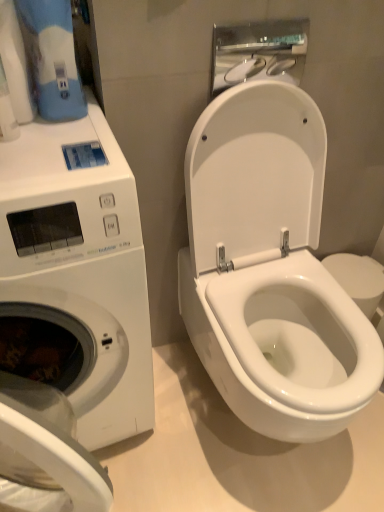
Question: Is white glossy hand dryer at upper center touching white glossy toilet at center?

Choices:
 (A) yes
 (B) no

Answer: (B)

Question: Would you say white glossy hand dryer at upper center is a long distance from white glossy toilet at center?

Choices:
 (A) yes
 (B) no

Answer: (B)

Question: Is white glossy hand dryer at upper center smaller than white glossy toilet at center?

Choices:
 (A) yes
 (B) no

Answer: (A)

Question: Does white glossy hand dryer at upper center come behind white glossy toilet at center?

Choices:
 (A) yes
 (B) no

Answer: (A)

Question: Considering the relative sizes of white glossy hand dryer at upper center and white glossy toilet at center in the image provided, is white glossy hand dryer at upper center thinner than white glossy toilet at center?

Choices:
 (A) yes
 (B) no

Answer: (A)

Question: Is white glossy hand dryer at upper center facing towards white glossy toilet at center?

Choices:
 (A) yes
 (B) no

Answer: (B)

Question: Can you confirm if white glossy toilet at center is positioned to the right of white glossy toilet paper at upper left?

Choices:
 (A) yes
 (B) no

Answer: (A)

Question: Does white glossy toilet at center have a greater height compared to white glossy toilet paper at upper left?

Choices:
 (A) yes
 (B) no

Answer: (A)

Question: Is white glossy toilet at center in front of white glossy toilet paper at upper left?

Choices:
 (A) no
 (B) yes

Answer: (B)

Question: Is white glossy toilet at center positioned far away from white glossy toilet paper at upper left?

Choices:
 (A) no
 (B) yes

Answer: (A)

Question: Is white glossy toilet at center surrounding white glossy toilet paper at upper left?

Choices:
 (A) no
 (B) yes

Answer: (A)

Question: Considering the relative sizes of white glossy toilet at center and white glossy toilet paper at upper left in the image provided, is white glossy toilet at center bigger than white glossy toilet paper at upper left?

Choices:
 (A) no
 (B) yes

Answer: (B)

Question: From a real-world perspective, is white glossy washing machine at left over white glossy hand dryer at upper center?

Choices:
 (A) yes
 (B) no

Answer: (B)